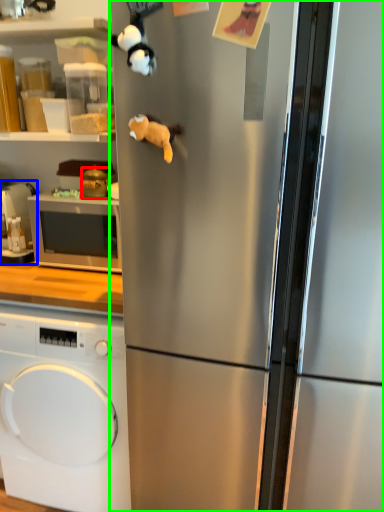
Question: Based on their relative distances, which object is nearer to appliance (highlighted by a red box)? Choose from appliance (highlighted by a blue box) and refrigerator (highlighted by a green box).

Choices:
 (A) appliance
 (B) refrigerator

Answer: (A)